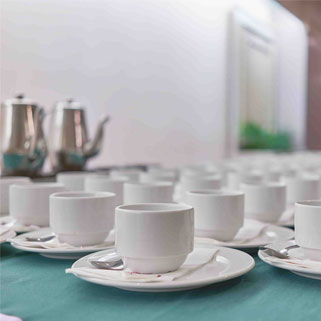
I want to click on spoon, so click(38, 242), click(1, 222), click(109, 264), click(274, 246).